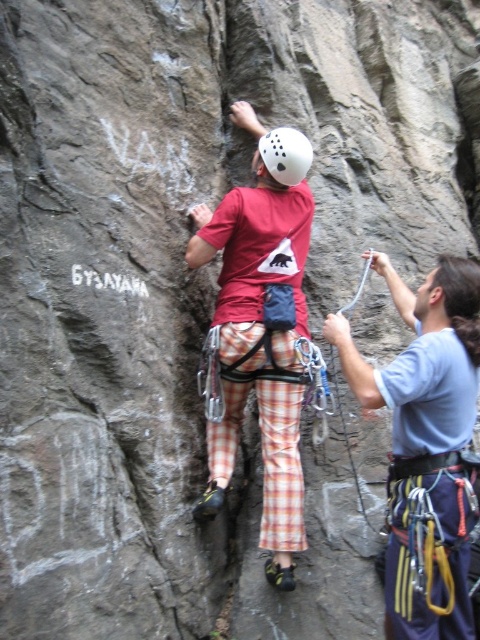
Can you confirm if blue fabric rope at right is positioned above matte red shirt at center?

No, blue fabric rope at right is not above matte red shirt at center.

Who is taller, blue fabric rope at right or matte red shirt at center?

Standing taller between the two is matte red shirt at center.

Does point (447, 442) come closer to viewer compared to point (268, 390)?

Yes, it is.

In order to click on blue fabric rope at right in this screenshot , I will do `click(425, 445)`.

Describe the element at coordinates (261, 330) in the screenshot. I see `matte red shirt at center` at that location.

Can you confirm if matte red shirt at center is bigger than white matte helmet at center?

Indeed, matte red shirt at center has a larger size compared to white matte helmet at center.

Identify the location of matte red shirt at center. (261, 330).

In the scene shown: Does blue fabric rope at right have a greater width compared to white matte helmet at center?

Yes.

At what (x,y) coordinates should I click in order to perform the action: click on blue fabric rope at right. Please return your answer as a coordinate pair (x, y). Looking at the image, I should click on (425, 445).